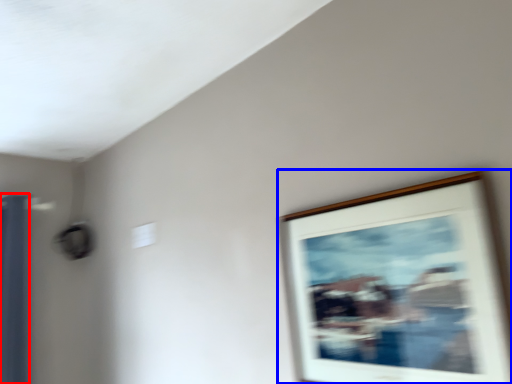
Question: Which point is further to the camera, curtain (highlighted by a red box) or picture frame (highlighted by a blue box)?

Choices:
 (A) curtain
 (B) picture frame

Answer: (A)